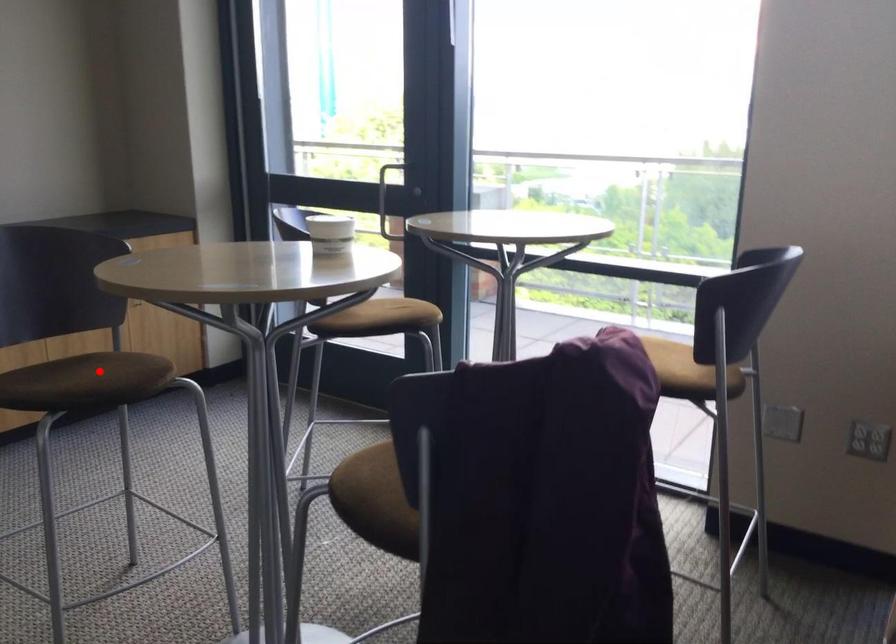
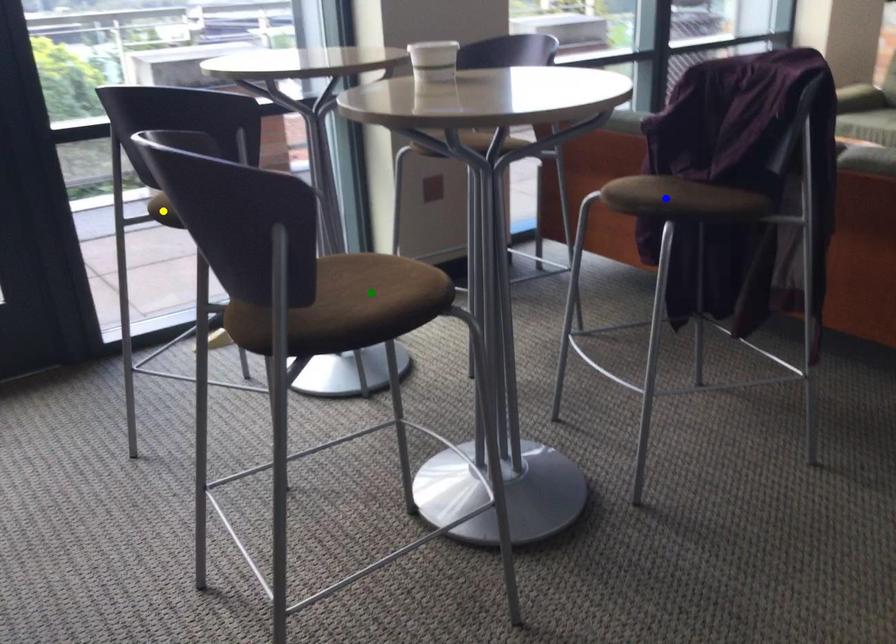
Question: I am providing you with two images of the same scene from different viewpoints. A red point is marked on the first image. You are given multiple points on the second image. Which point in image 2 is actually the same real-world point as the red point in image 1?

Choices:
 (A) yellow point
 (B) green point
 (C) blue point

Answer: (B)